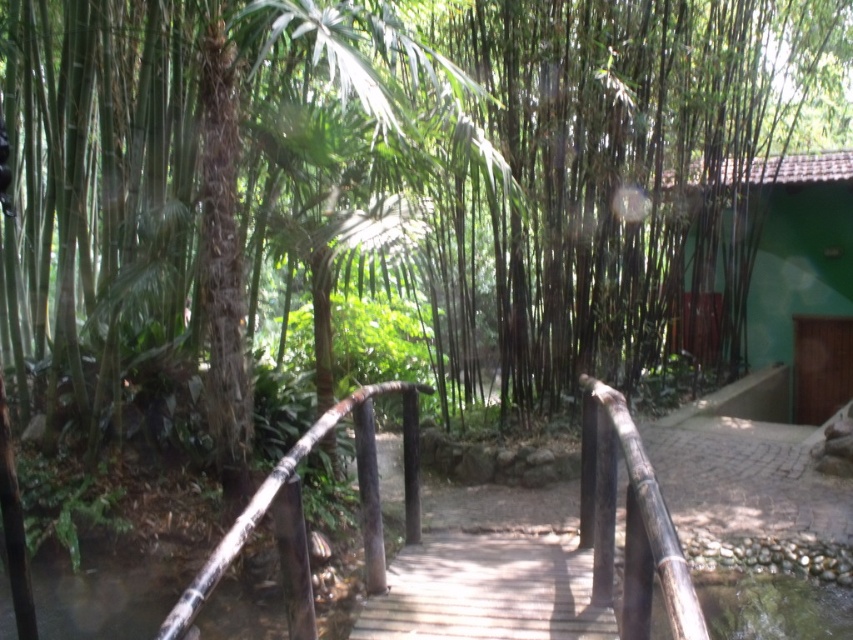
Question: Observing the image, what is the correct spatial positioning of green matte hut at right in reference to brown rough bamboo rail at center?

Choices:
 (A) right
 (B) left

Answer: (A)

Question: Which point is farther to the camera?

Choices:
 (A) brown rough bamboo rail at center
 (B) green matte hut at right
 (C) white glossy rail at center

Answer: (B)

Question: Which point appears farthest from the camera in this image?

Choices:
 (A) (817, 282)
 (B) (238, 548)
 (C) (625, 532)

Answer: (A)

Question: Which point is closer to the camera?

Choices:
 (A) green matte hut at right
 (B) white glossy rail at center

Answer: (B)

Question: Is green matte hut at right thinner than white glossy rail at center?

Choices:
 (A) yes
 (B) no

Answer: (B)

Question: In this image, where is green matte hut at right located relative to white glossy rail at center?

Choices:
 (A) left
 (B) right

Answer: (B)